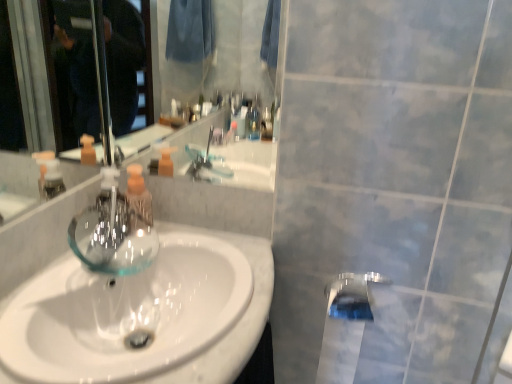
Identify the location of free point to the right of clear glass bottle at center. 184,244.